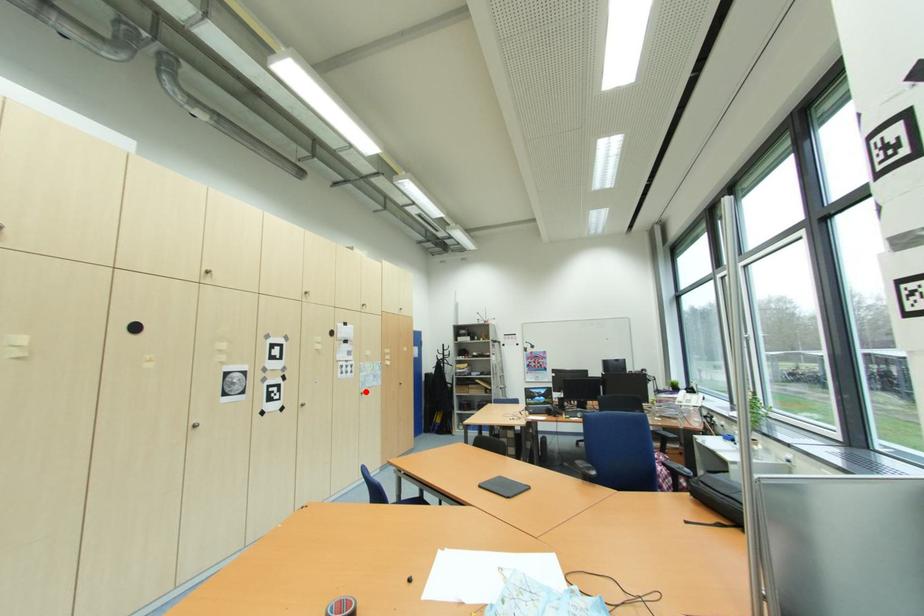
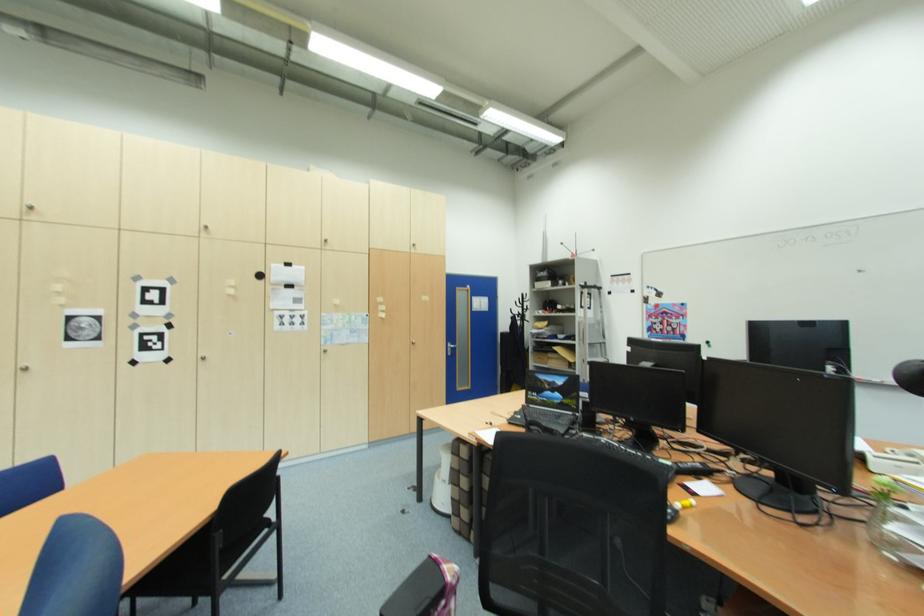
Question: A red point is marked in image1. In image2, is the corresponding 3D point closer to the camera or farther? Reply with the corresponding letter.

Choices:
 (A) The corresponding 3D point is closer.
 (B) The corresponding 3D point is farther.

Answer: (A)